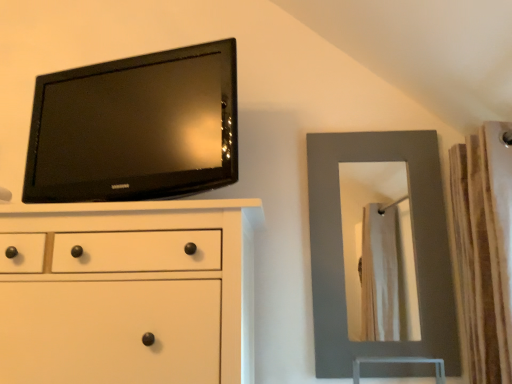
Question: Can you confirm if matte gray mirror at right is positioned to the left of brown textured curtain at right?

Choices:
 (A) no
 (B) yes

Answer: (B)

Question: Considering the relative sizes of matte gray mirror at right and brown textured curtain at right in the image provided, is matte gray mirror at right taller than brown textured curtain at right?

Choices:
 (A) yes
 (B) no

Answer: (A)

Question: Is matte gray mirror at right to the right of brown textured curtain at right from the viewer's perspective?

Choices:
 (A) no
 (B) yes

Answer: (A)

Question: Does matte gray mirror at right have a lesser width compared to brown textured curtain at right?

Choices:
 (A) no
 (B) yes

Answer: (B)

Question: Is matte gray mirror at right smaller than brown textured curtain at right?

Choices:
 (A) no
 (B) yes

Answer: (B)

Question: From the image's perspective, relative to brown textured curtain at right, is matte gray mirror at right above or below?

Choices:
 (A) above
 (B) below

Answer: (B)

Question: Would you say matte gray mirror at right is to the left or to the right of brown textured curtain at right in the picture?

Choices:
 (A) left
 (B) right

Answer: (A)

Question: From a real-world perspective, is matte gray mirror at right positioned above or below brown textured curtain at right?

Choices:
 (A) below
 (B) above

Answer: (B)

Question: Is matte gray mirror at right taller or shorter than brown textured curtain at right?

Choices:
 (A) tall
 (B) short

Answer: (A)

Question: Visually, is brown textured curtain at right positioned to the left or to the right of matte white chest of drawers at upper left?

Choices:
 (A) left
 (B) right

Answer: (B)

Question: Is brown textured curtain at right bigger or smaller than matte white chest of drawers at upper left?

Choices:
 (A) big
 (B) small

Answer: (B)

Question: In terms of width, does brown textured curtain at right look wider or thinner when compared to matte white chest of drawers at upper left?

Choices:
 (A) wide
 (B) thin

Answer: (B)

Question: From a real-world perspective, relative to matte white chest of drawers at upper left, is brown textured curtain at right vertically above or below?

Choices:
 (A) above
 (B) below

Answer: (A)

Question: From the image's perspective, is matte gray mirror at right located above or below black glossy tv at upper left?

Choices:
 (A) above
 (B) below

Answer: (B)

Question: Choose the correct answer: Is matte gray mirror at right inside black glossy tv at upper left or outside it?

Choices:
 (A) outside
 (B) inside

Answer: (A)